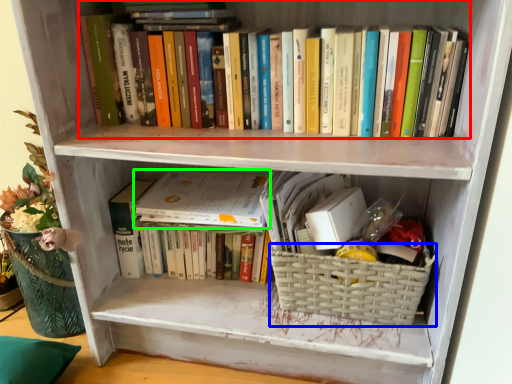
Question: Which object is the farthest from book (highlighted by a red box)? Choose among these: basket (highlighted by a blue box) or paperback book (highlighted by a green box).

Choices:
 (A) basket
 (B) paperback book

Answer: (A)